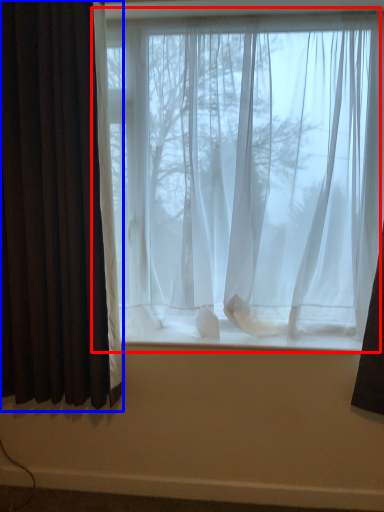
Question: Which point is further to the camera, window (highlighted by a red box) or curtain (highlighted by a blue box)?

Choices:
 (A) window
 (B) curtain

Answer: (A)